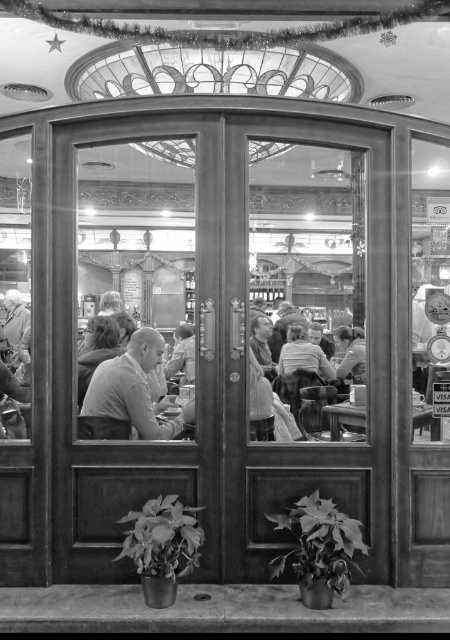
Question: Which point is farther from the camera taking this photo?

Choices:
 (A) (364, 352)
 (B) (436, 435)

Answer: (A)

Question: Is smooth wooden table at center wider than smooth skin person at center?

Choices:
 (A) no
 (B) yes

Answer: (B)

Question: Which object appears farthest from the camera in this image?

Choices:
 (A) smooth gray shirt at center
 (B) smooth skin person at center
 (C) smooth wooden table at center
 (D) smooth leather jacket at left

Answer: (D)

Question: Among these points, which one is nearest to the camera?

Choices:
 (A) (18, 326)
 (B) (179, 333)
 (C) (337, 369)

Answer: (C)

Question: Observing the image, what is the correct spatial positioning of smooth fabric shirt at center in reference to smooth beige shirt at center?

Choices:
 (A) above
 (B) below

Answer: (A)

Question: In this image, where is smooth wooden table at center located relative to smooth skin person at center?

Choices:
 (A) below
 (B) above

Answer: (A)